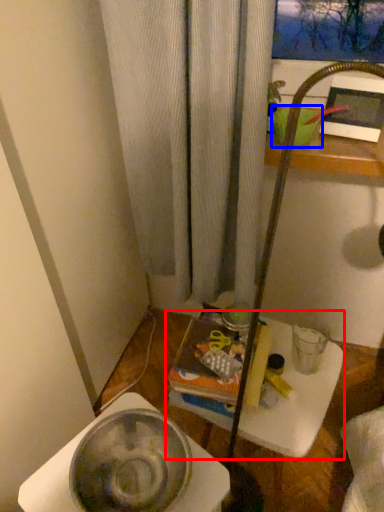
Question: Which object appears closest to the camera in this image, table (highlighted by a red box) or basin (highlighted by a blue box)?

Choices:
 (A) table
 (B) basin

Answer: (A)